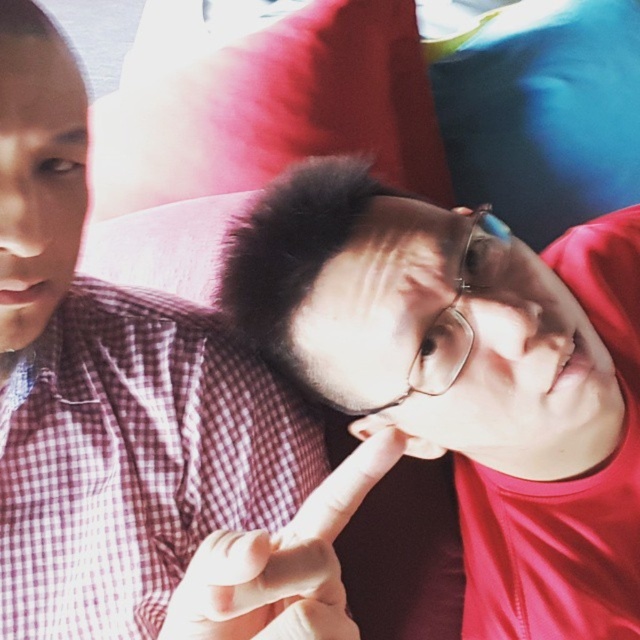
Question: Estimate the real-world distances between objects in this image. Which object is farther from the matte red pillow at upper center?

Choices:
 (A) matte red shirt at center
 (B) matte checkered shirt at left
 (C) white matte finger at center

Answer: (C)

Question: Which point appears closest to the camera in this image?

Choices:
 (A) (4, 131)
 (B) (296, 554)
 (C) (360, 40)
 (D) (570, 51)

Answer: (B)

Question: Is matte checkered shirt at left smaller than white matte finger at center?

Choices:
 (A) yes
 (B) no

Answer: (B)

Question: Can you confirm if matte red pillow at upper center is positioned above white matte finger at center?

Choices:
 (A) yes
 (B) no

Answer: (A)

Question: Does matte checkered shirt at left come in front of white matte finger at center?

Choices:
 (A) no
 (B) yes

Answer: (A)

Question: Which point is farther to the camera?

Choices:
 (A) (16, 42)
 (B) (259, 44)
 (C) (540, 582)

Answer: (B)